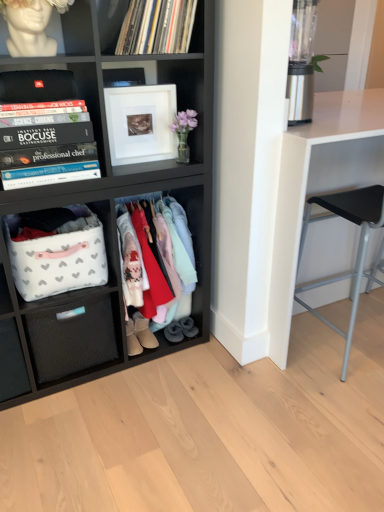
Question: Is there a large distance between dark gray suede slippers at lower center, which is the 2th footwear in right-to-left order, and beige suede boot at lower center, marked as the third footwear in a right-to-left arrangement?

Choices:
 (A) yes
 (B) no

Answer: (B)

Question: From a real-world perspective, is dark gray suede slippers at lower center, which is the 2th footwear in right-to-left order, positioned under beige suede boot at lower center, marked as the third footwear in a right-to-left arrangement, based on gravity?

Choices:
 (A) no
 (B) yes

Answer: (B)

Question: Does dark gray suede slippers at lower center, which is the 2th footwear from left to right, have a greater height compared to beige suede boot at lower center, marked as the third footwear in a right-to-left arrangement?

Choices:
 (A) yes
 (B) no

Answer: (B)

Question: Can you confirm if dark gray suede slippers at lower center, which is the 2th footwear in right-to-left order, is smaller than beige suede boot at lower center, which appears as the 1th footwear when viewed from the left?

Choices:
 (A) no
 (B) yes

Answer: (B)

Question: Is dark gray suede slippers at lower center, which is the 2th footwear from left to right, turned away from beige suede boot at lower center, which appears as the 1th footwear when viewed from the left?

Choices:
 (A) no
 (B) yes

Answer: (A)

Question: Is beige suede boot at lower center, marked as the third footwear in a right-to-left arrangement, inside dark gray suede slippers at lower center, which is the 2th footwear from left to right?

Choices:
 (A) no
 (B) yes

Answer: (A)

Question: Is white glossy table at right not inside white fabric basket at lower left?

Choices:
 (A) yes
 (B) no

Answer: (A)

Question: Is white glossy table at right in contact with white fabric basket at lower left?

Choices:
 (A) yes
 (B) no

Answer: (B)

Question: From a real-world perspective, does white glossy table at right sit lower than white fabric basket at lower left?

Choices:
 (A) no
 (B) yes

Answer: (B)

Question: Is white glossy table at right thinner than white fabric basket at lower left?

Choices:
 (A) yes
 (B) no

Answer: (B)

Question: Is white glossy table at right looking in the opposite direction of white fabric basket at lower left?

Choices:
 (A) no
 (B) yes

Answer: (A)

Question: Is white glossy table at right wider than white fabric basket at lower left?

Choices:
 (A) no
 (B) yes

Answer: (B)

Question: Considering the relative positions of white fabric basket at lower left and black woven drawer at lower left in the image provided, is white fabric basket at lower left in front of black woven drawer at lower left?

Choices:
 (A) yes
 (B) no

Answer: (A)